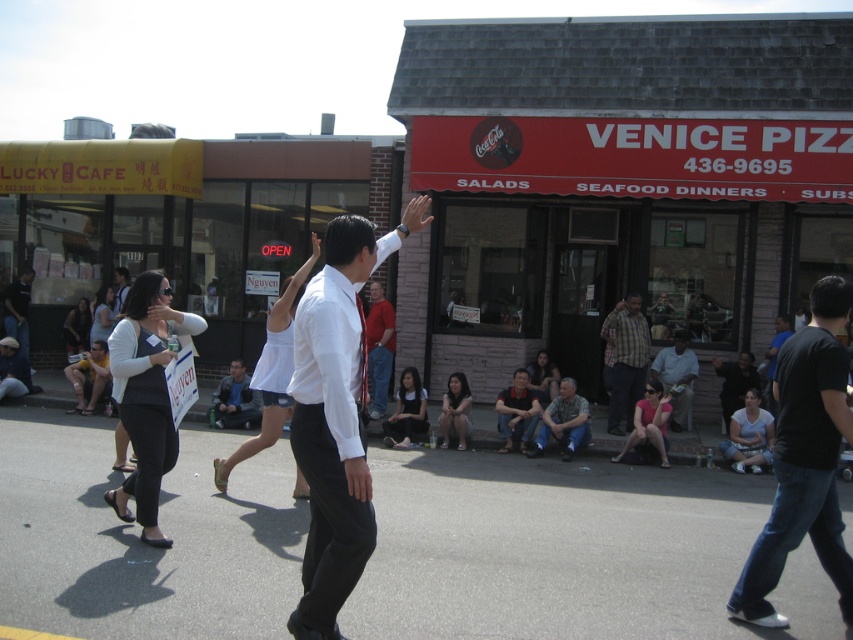
You are standing at the entrance of Venice Pizza and want to find the dark blue jacket at center. According to the coordinates provided, in which direction should you look relative to the entrance?

The dark blue jacket at center is located at coordinates point (234,401), so you should look towards the center of the image from the entrance.

You are a photographer standing in front of the Venice Pizza restaurant. You notice a man in a camouflage fabric shirt at lower center and dark blue jeans at lower right. Which clothing item is shorter in height?

The camouflage fabric shirt at lower center has a lesser height compared to the dark blue jeans at lower right, so the camouflage fabric shirt at lower center is shorter in height.

You are a photographer trying to capture the man in the camouflage fabric shirt at lower center and the dark blue jeans at lower right. Since you want both subjects in the frame, which direction should you move your camera to ensure both are visible?

You should move your camera to the right to ensure both the camouflage fabric shirt at lower center and the dark blue jeans at lower right are visible, as the camouflage fabric shirt at lower center is to the left of the dark blue jeans at lower right.